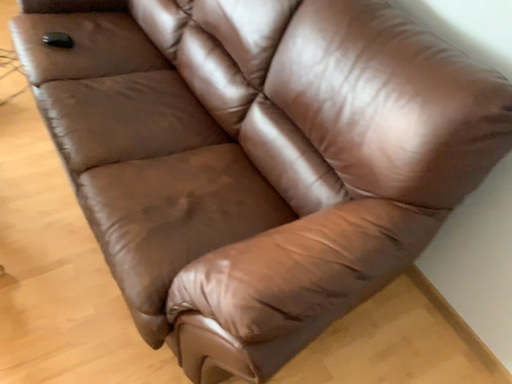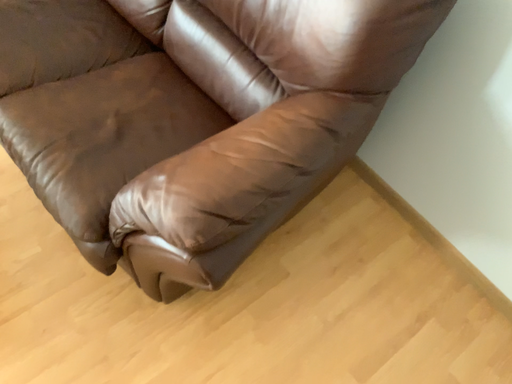
Question: How did the camera likely rotate when shooting the video?

Choices:
 (A) rotated right
 (B) rotated left

Answer: (A)